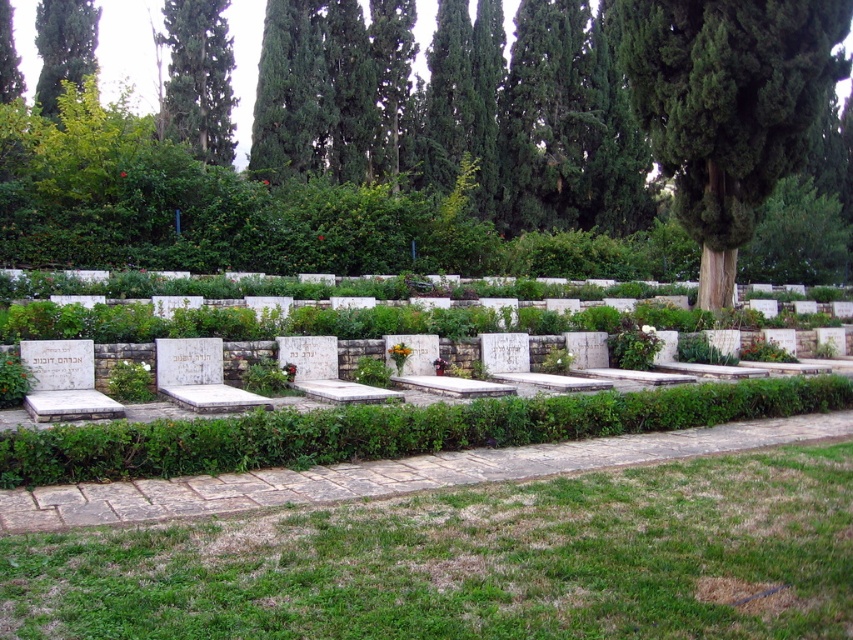
Question: Which point appears closest to the camera in this image?

Choices:
 (A) tap(660, 129)
 (B) tap(57, 61)
 (C) tap(229, 131)
 (D) tap(572, 35)

Answer: (A)

Question: Is green grass at lower center to the right of green leafy tree at upper left from the viewer's perspective?

Choices:
 (A) yes
 (B) no

Answer: (A)

Question: Does green grass at lower center have a larger size compared to green leafy tree at upper left?

Choices:
 (A) yes
 (B) no

Answer: (B)

Question: Which object appears farthest from the camera in this image?

Choices:
 (A) green leafy tree at upper left
 (B) green textured tree at center
 (C) green grass at lower center
 (D) green leafy tree at upper center

Answer: (D)

Question: Is green leafy tree at upper center behind green leafy tree at upper left?

Choices:
 (A) no
 (B) yes

Answer: (B)

Question: Which is farther from the green leafy tree at center?

Choices:
 (A) green textured tree at center
 (B) green leafy tree at upper center
 (C) green leafy tree at upper left
 (D) green grass at lower center

Answer: (D)